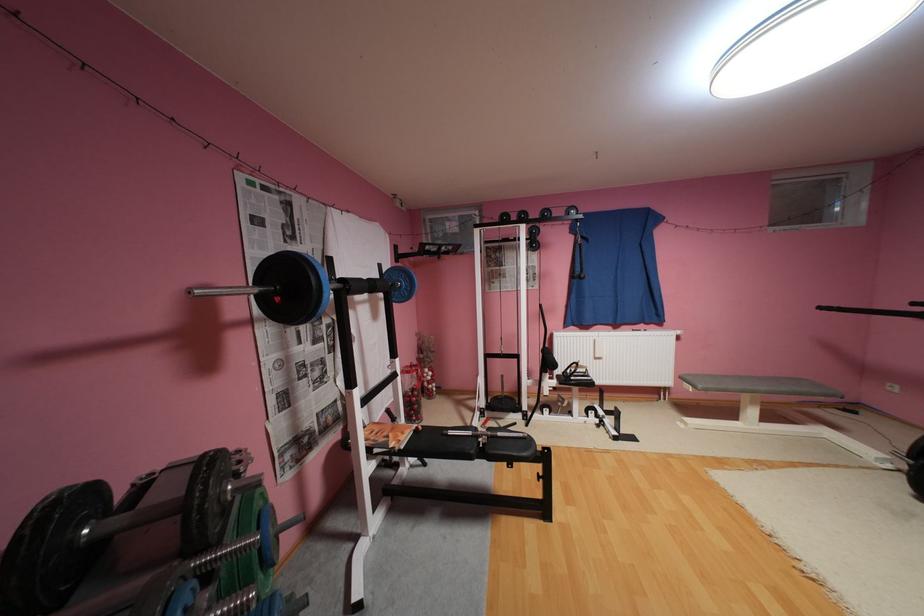
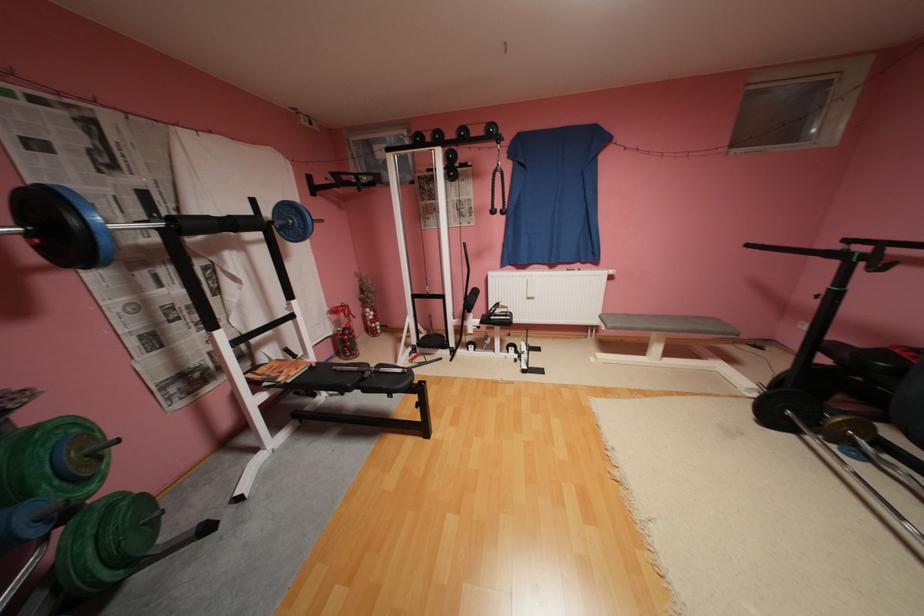
Where in the second image is the point corresponding to the point at 410,447 from the first image?

(298, 381)